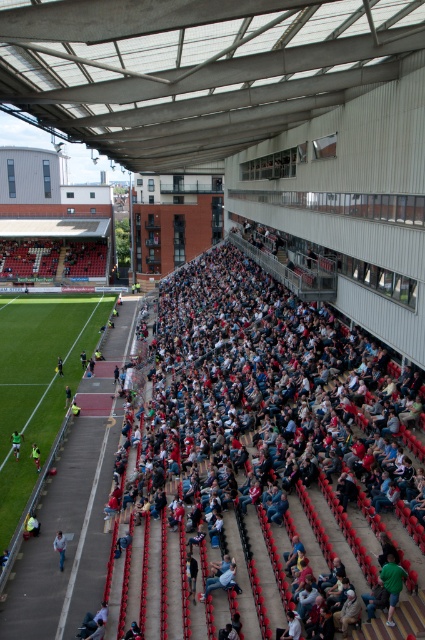
Can you confirm if red plastic seats at center is shorter than yellow jersey at lower left?

No, red plastic seats at center is not shorter than yellow jersey at lower left.

Is red plastic seats at center taller than yellow jersey at lower left?

Indeed, red plastic seats at center has a greater height compared to yellow jersey at lower left.

Does point (166, 332) come behind point (56, 362)?

Yes, point (166, 332) is farther from viewer.

This screenshot has width=425, height=640. Find the location of `red plastic seats at center`. red plastic seats at center is located at coordinates (261, 404).

Is green grass football field at left above yellow fabric jacket at lower left?

Yes, green grass football field at left is above yellow fabric jacket at lower left.

I want to click on green grass football field at left, so click(37, 381).

Does red plastic seats at center lie behind denim jeans at lower left?

No, red plastic seats at center is closer to the viewer.

Does point (326, 536) come behind point (59, 538)?

No, (326, 536) is closer to viewer.

Is point (300, 442) in front of point (62, 556)?

No.

Where is `red plastic seats at center`? red plastic seats at center is located at coordinates [x=261, y=404].